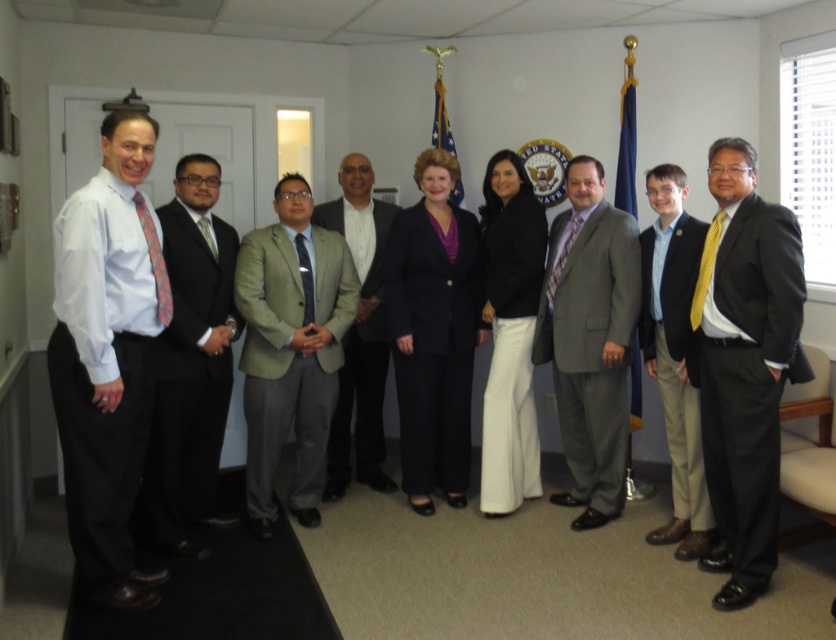
Question: Which of these objects is positioned farthest from the green silk tie at center?

Choices:
 (A) matte black suit at center
 (B) light gray suit at center

Answer: (B)

Question: Which of the following is the farthest from the observer?

Choices:
 (A) dark gray suit at center
 (B) light gray suit at center
 (C) gray textured suit at center
 (D) light brown fabric suit at center

Answer: (B)

Question: Among these points, which one is nearest to the camera?

Choices:
 (A) (82, 576)
 (B) (467, 259)
 (C) (573, 230)

Answer: (A)

Question: Is patterned silk tie at left to the right of green silk tie at center from the viewer's perspective?

Choices:
 (A) no
 (B) yes

Answer: (B)

Question: Does black satin suit at right appear on the right side of light gray suit at center?

Choices:
 (A) yes
 (B) no

Answer: (A)

Question: Is yellow satin tie at right in front of dark gray silk tie at center?

Choices:
 (A) no
 (B) yes

Answer: (B)